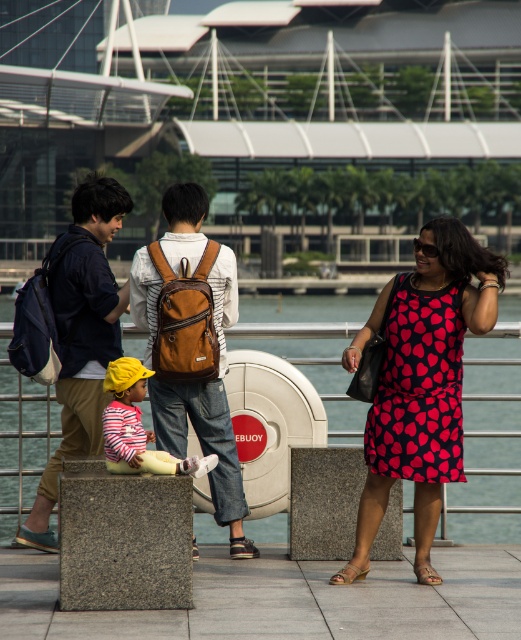
You are planning to take a photo of the clear blue water at center and the dark red printed dress at center. Which object should you focus on first if you want to capture both in the frame without moving the camera?

The clear blue water at center is bigger than the dark red printed dress at center, so you should focus on the clear blue water at center first to ensure it fills the frame appropriately before adjusting for the smaller dark red printed dress at center.

What object is located at the coordinates point (424, 385)?

The point (424, 385) is on the printed fabric dress at center.

You are a photographer trying to capture a photo of the printed fabric dress at center and the brown leather backpack at center. Which object should you zoom in on to ensure it appears larger in your photo?

The printed fabric dress at center has a lesser width compared to the brown leather backpack at center, so you should zoom in on the brown leather backpack at center to make it appear larger in the photo.